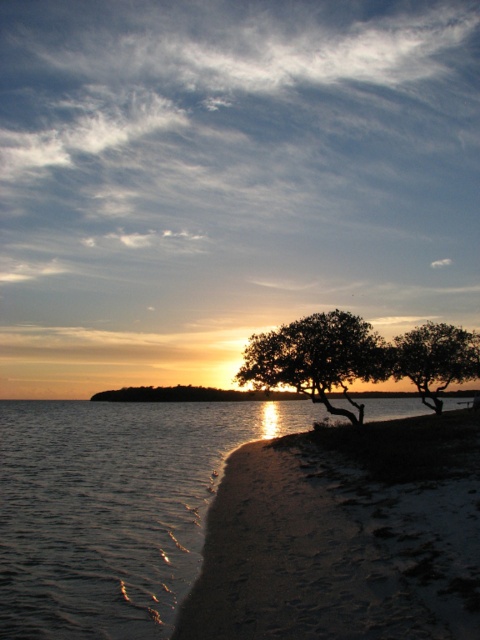
Question: Which of the following is the closest to the observer?

Choices:
 (A) green matte tree at lower right
 (B) sandy beach at lower right

Answer: (B)

Question: Which object appears closest to the camera in this image?

Choices:
 (A) green matte tree at lower right
 (B) sandy beach at lower right

Answer: (B)

Question: Which point is farther to the camera?

Choices:
 (A) sandy beach at lower right
 (B) green matte tree at lower right

Answer: (B)

Question: Does silhouette wood tree at center have a lesser width compared to green matte tree at lower right?

Choices:
 (A) no
 (B) yes

Answer: (A)

Question: Is silhouette wood tree at center smaller than green matte tree at lower right?

Choices:
 (A) no
 (B) yes

Answer: (B)

Question: Is silhouette wood tree at center positioned behind green matte tree at lower right?

Choices:
 (A) no
 (B) yes

Answer: (A)